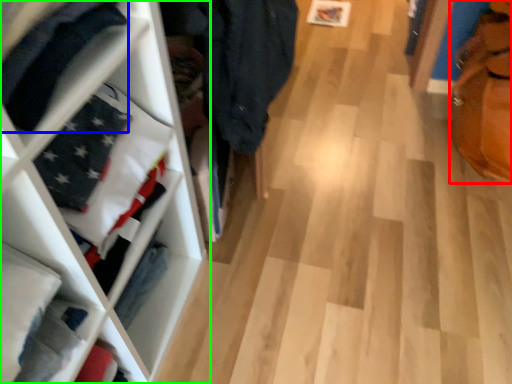
Question: Estimate the real-world distances between objects in this image. Which object is farther from tote bag (highlighted by a red box), clothing (highlighted by a blue box) or shelf (highlighted by a green box)?

Choices:
 (A) clothing
 (B) shelf

Answer: (A)